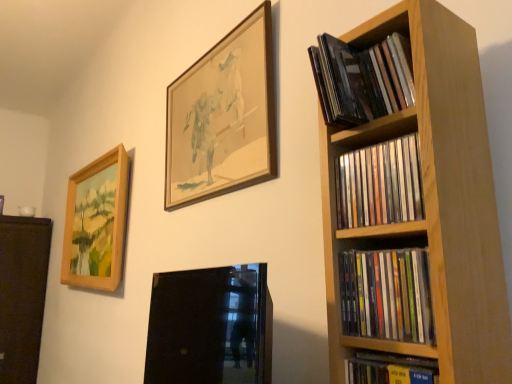
Measure the distance between wooden-framed painting at left, which ranks as the 1th picture frame in left-to-right order, and camera.

wooden-framed painting at left, which ranks as the 1th picture frame in left-to-right order, and camera are 1.94 meters apart.

What do you see at coordinates (380, 184) in the screenshot? I see `wooden cd cases at right, the second book from the top` at bounding box center [380, 184].

Measure the distance between point (342, 119) and camera.

A distance of 24.80 inches exists between point (342, 119) and camera.

The image size is (512, 384). Identify the location of hardcover book at lower right, marked as the first book in a bottom-to-top arrangement. (389, 369).

Where is `wooden-framed painting at left, which ranks as the 1th picture frame in left-to-right order`? wooden-framed painting at left, which ranks as the 1th picture frame in left-to-right order is located at coordinates (96, 222).

From the image's perspective, which one is positioned higher, matte plastic cds at right, arranged as the 3th book when viewed from the top, or black glass picture frame at lower center, which is the second picture frame in left-to-right order?

From the image's view, matte plastic cds at right, arranged as the 3th book when viewed from the top, is above.

Relative to black glass picture frame at lower center, the 2th picture frame in the right-to-left sequence, is matte plastic cds at right, the second book ordered from the bottom, in front or behind?

Clearly, matte plastic cds at right, the second book ordered from the bottom, is behind black glass picture frame at lower center, the 2th picture frame in the right-to-left sequence.

Between matte plastic cds at right, the second book ordered from the bottom, and black glass picture frame at lower center, the first picture frame in the front-to-back sequence, which one has more height?

black glass picture frame at lower center, the first picture frame in the front-to-back sequence, is taller.

In the scene shown: Would you say matte plastic cds at right, the second book ordered from the bottom, is to the left or to the right of black glass picture frame at lower center, the 2th picture frame in the right-to-left sequence, in the picture?

matte plastic cds at right, the second book ordered from the bottom, is to the right of black glass picture frame at lower center, the 2th picture frame in the right-to-left sequence.

Can you confirm if wooden-framed painting at left, arranged as the first picture frame when viewed from the back, is positioned to the right of matte black cds at upper right, arranged as the first book when viewed from the top?

In fact, wooden-framed painting at left, arranged as the first picture frame when viewed from the back, is to the left of matte black cds at upper right, arranged as the first book when viewed from the top.

Consider the image. Is wooden-framed painting at left, the third picture frame positioned from the front, wider or thinner than matte black cds at upper right, arranged as the first book when viewed from the top?

wooden-framed painting at left, the third picture frame positioned from the front, is wider than matte black cds at upper right, arranged as the first book when viewed from the top.

From the image's perspective, does wooden-framed painting at left, the third picture frame positioned from the front, appear lower than matte black cds at upper right, arranged as the first book when viewed from the top?

Yes, from the image's perspective, wooden-framed painting at left, the third picture frame positioned from the front, is beneath matte black cds at upper right, arranged as the first book when viewed from the top.

From a real-world perspective, is wooden-framed painting at left, which ranks as the 1th picture frame in left-to-right order, on matte black cds at upper right, which is the fourth book in bottom-to-top order?

No.

Consider the image. Is hardcover book at lower right, the fourth book when ordered from top to bottom, oriented towards wooden picture frame at upper center, which is the 2th picture frame in front-to-back order?

No.

Considering the relative positions of hardcover book at lower right, marked as the first book in a bottom-to-top arrangement, and wooden picture frame at upper center, which is the 2th picture frame in front-to-back order, in the image provided, is hardcover book at lower right, marked as the first book in a bottom-to-top arrangement, to the left of wooden picture frame at upper center, which is the 2th picture frame in front-to-back order, from the viewer's perspective?

No.

Does hardcover book at lower right, the fourth book when ordered from top to bottom, have a larger size compared to wooden picture frame at upper center, acting as the second picture frame starting from the back?

No, hardcover book at lower right, the fourth book when ordered from top to bottom, is not bigger than wooden picture frame at upper center, acting as the second picture frame starting from the back.

Considering the points (385, 380) and (276, 163), which point is behind, point (385, 380) or point (276, 163)?

The point (276, 163) is farther from the camera.

What are the coordinates of `the 1st book to the left when counting from the matte black cds at upper right, which is the fourth book in bottom-to-top order` in the screenshot? It's located at (389, 369).

Which object is further away from the camera, matte black cds at upper right, arranged as the first book when viewed from the top, or hardcover book at lower right, the fourth book when ordered from top to bottom?

matte black cds at upper right, arranged as the first book when viewed from the top, is more distant.

Can you confirm if matte black cds at upper right, arranged as the first book when viewed from the top, is wider than hardcover book at lower right, the fourth book when ordered from top to bottom?

Correct, the width of matte black cds at upper right, arranged as the first book when viewed from the top, exceeds that of hardcover book at lower right, the fourth book when ordered from top to bottom.

Is matte black cds at upper right, which is the fourth book in bottom-to-top order, positioned with its back to hardcover book at lower right, marked as the first book in a bottom-to-top arrangement?

No, hardcover book at lower right, marked as the first book in a bottom-to-top arrangement, is not at the back of matte black cds at upper right, which is the fourth book in bottom-to-top order.

Does black glass picture frame at lower center, the first picture frame in the front-to-back sequence, have a lesser width compared to hardcover book at lower right, marked as the first book in a bottom-to-top arrangement?

In fact, black glass picture frame at lower center, the first picture frame in the front-to-back sequence, might be wider than hardcover book at lower right, marked as the first book in a bottom-to-top arrangement.

Based on their positions, is black glass picture frame at lower center, the first picture frame in the front-to-back sequence, located to the left or right of hardcover book at lower right, the fourth book when ordered from top to bottom?

Based on their positions, black glass picture frame at lower center, the first picture frame in the front-to-back sequence, is located to the left of hardcover book at lower right, the fourth book when ordered from top to bottom.

Consider the image. Is black glass picture frame at lower center, which is the second picture frame in left-to-right order, inside or outside of hardcover book at lower right, the fourth book when ordered from top to bottom?

The correct answer is: outside.

Considering the positions of points (409, 362) and (424, 334), is point (409, 362) closer to camera compared to point (424, 334)?

No, (409, 362) is behind (424, 334).

Which of these two, hardcover book at lower right, the fourth book when ordered from top to bottom, or matte plastic cds at right, the second book ordered from the bottom, is thinner?

matte plastic cds at right, the second book ordered from the bottom, is thinner.

Based on the photo, which of these two, hardcover book at lower right, the fourth book when ordered from top to bottom, or matte plastic cds at right, arranged as the 3th book when viewed from the top, is smaller?

With smaller size is hardcover book at lower right, the fourth book when ordered from top to bottom.

Locate an element on the screen. This screenshot has height=384, width=512. book that is the 1st object to the left of the hardcover book at lower right, marked as the first book in a bottom-to-top arrangement, starting at the anchor is located at coordinates [387, 295].

Is black glass picture frame at lower center, the third picture frame in the back-to-front sequence, shorter than wooden-framed painting at left, arranged as the first picture frame when viewed from the back?

Correct, black glass picture frame at lower center, the third picture frame in the back-to-front sequence, is not as tall as wooden-framed painting at left, arranged as the first picture frame when viewed from the back.

Does black glass picture frame at lower center, the 2th picture frame in the right-to-left sequence, contain wooden-framed painting at left, the third picture frame positioned from the front?

Actually, wooden-framed painting at left, the third picture frame positioned from the front, is outside black glass picture frame at lower center, the 2th picture frame in the right-to-left sequence.

Can you see black glass picture frame at lower center, the first picture frame in the front-to-back sequence, touching wooden-framed painting at left, arranged as the first picture frame when viewed from the back?

No, black glass picture frame at lower center, the first picture frame in the front-to-back sequence, is not in contact with wooden-framed painting at left, arranged as the first picture frame when viewed from the back.

Where is `picture frame below the wooden-framed painting at left, which ranks as the 1th picture frame in left-to-right order (from a real-world perspective)`? This screenshot has width=512, height=384. picture frame below the wooden-framed painting at left, which ranks as the 1th picture frame in left-to-right order (from a real-world perspective) is located at coordinates (210, 327).

From the black glass picture frame at lower center, the first picture frame in the front-to-back sequence, count 2nd book to the right and point to it. Please provide its 2D coordinates.

[(387, 295)]

I want to click on the 2nd picture frame behind the matte black cds at upper right, arranged as the first book when viewed from the top, so click(96, 222).

Which object lies further to the anchor point wooden picture frame at upper center, which is the 3th picture frame from left to right, wooden cd cases at right, the second book from the top, or hardcover book at lower right, the fourth book when ordered from top to bottom?

The object further to wooden picture frame at upper center, which is the 3th picture frame from left to right, is hardcover book at lower right, the fourth book when ordered from top to bottom.

Estimate the real-world distances between objects in this image. Which object is further from black glass picture frame at lower center, the third picture frame in the back-to-front sequence, matte black cds at upper right, which is the fourth book in bottom-to-top order, or wooden picture frame at upper center, which is the 3th picture frame from left to right?

Based on the image, matte black cds at upper right, which is the fourth book in bottom-to-top order, appears to be further to black glass picture frame at lower center, the third picture frame in the back-to-front sequence.

Which object lies further to the anchor point matte black cds at upper right, arranged as the first book when viewed from the top, wooden-framed painting at left, arranged as the first picture frame when viewed from the back, or black glass picture frame at lower center, which is the second picture frame in left-to-right order?

Among the two, black glass picture frame at lower center, which is the second picture frame in left-to-right order, is located further to matte black cds at upper right, arranged as the first book when viewed from the top.

From the picture: Which object lies nearer to the anchor point black glass picture frame at lower center, which is the second picture frame in left-to-right order, wooden picture frame at upper center, which is the 3th picture frame from left to right, or matte plastic cds at right, the second book ordered from the bottom?

The object closer to black glass picture frame at lower center, which is the second picture frame in left-to-right order, is wooden picture frame at upper center, which is the 3th picture frame from left to right.

Looking at the image, which one is located closer to wooden picture frame at upper center, which is the 3th picture frame from left to right, hardcover book at lower right, marked as the first book in a bottom-to-top arrangement, or matte black cds at upper right, which is the fourth book in bottom-to-top order?

Based on the image, matte black cds at upper right, which is the fourth book in bottom-to-top order, appears to be nearer to wooden picture frame at upper center, which is the 3th picture frame from left to right.

Estimate the real-world distances between objects in this image. Which object is further from hardcover book at lower right, the fourth book when ordered from top to bottom, matte black cds at upper right, which is the fourth book in bottom-to-top order, or wooden cd cases at right, the second book from the top?

matte black cds at upper right, which is the fourth book in bottom-to-top order, is further to hardcover book at lower right, the fourth book when ordered from top to bottom.

Looking at the image, which one is located further to hardcover book at lower right, the fourth book when ordered from top to bottom, black glass picture frame at lower center, the 2th picture frame in the right-to-left sequence, or wooden picture frame at upper center, acting as the second picture frame starting from the back?

black glass picture frame at lower center, the 2th picture frame in the right-to-left sequence, is further to hardcover book at lower right, the fourth book when ordered from top to bottom.

Looking at the image, which one is located further to wooden cd cases at right, the 3th book ordered from the bottom, wooden picture frame at upper center, which is the 2th picture frame in front-to-back order, or matte black cds at upper right, which is the fourth book in bottom-to-top order?

Among the two, wooden picture frame at upper center, which is the 2th picture frame in front-to-back order, is located further to wooden cd cases at right, the 3th book ordered from the bottom.

This screenshot has width=512, height=384. Find the location of `book positioned between wooden cd cases at right, the second book from the top, and wooden picture frame at upper center, acting as the second picture frame starting from the back, from near to far`. book positioned between wooden cd cases at right, the second book from the top, and wooden picture frame at upper center, acting as the second picture frame starting from the back, from near to far is located at coordinates (362, 79).

The height and width of the screenshot is (384, 512). What are the coordinates of `picture frame positioned between matte black cds at upper right, which is the fourth book in bottom-to-top order, and wooden-framed painting at left, the third picture frame positioned from the front, from near to far` in the screenshot? It's located at (223, 117).

Where is `picture frame positioned between matte plastic cds at right, the second book ordered from the bottom, and wooden-framed painting at left, marked as the third picture frame in a right-to-left arrangement, from near to far`? The width and height of the screenshot is (512, 384). picture frame positioned between matte plastic cds at right, the second book ordered from the bottom, and wooden-framed painting at left, marked as the third picture frame in a right-to-left arrangement, from near to far is located at coordinates (223, 117).

Where is `book between wooden cd cases at right, the second book from the top, and wooden-framed painting at left, marked as the third picture frame in a right-to-left arrangement, from front to back`? The image size is (512, 384). book between wooden cd cases at right, the second book from the top, and wooden-framed painting at left, marked as the third picture frame in a right-to-left arrangement, from front to back is located at coordinates (362, 79).